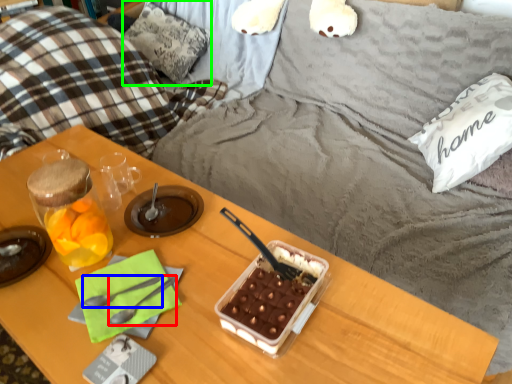
Question: Estimate the real-world distances between objects in this image. Which object is farther from spoon (highlighted by a red box), spoon (highlighted by a blue box) or pillow (highlighted by a green box)?

Choices:
 (A) spoon
 (B) pillow

Answer: (B)